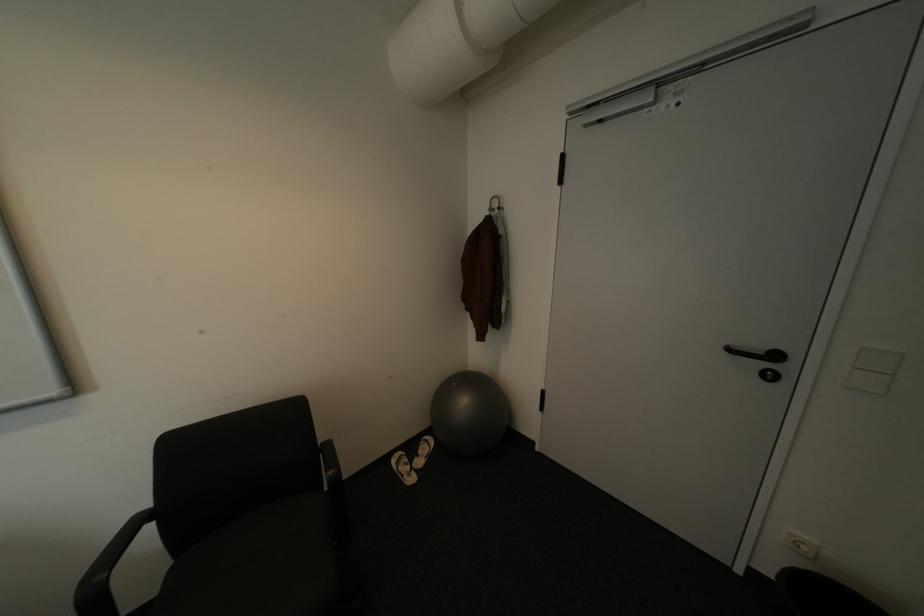
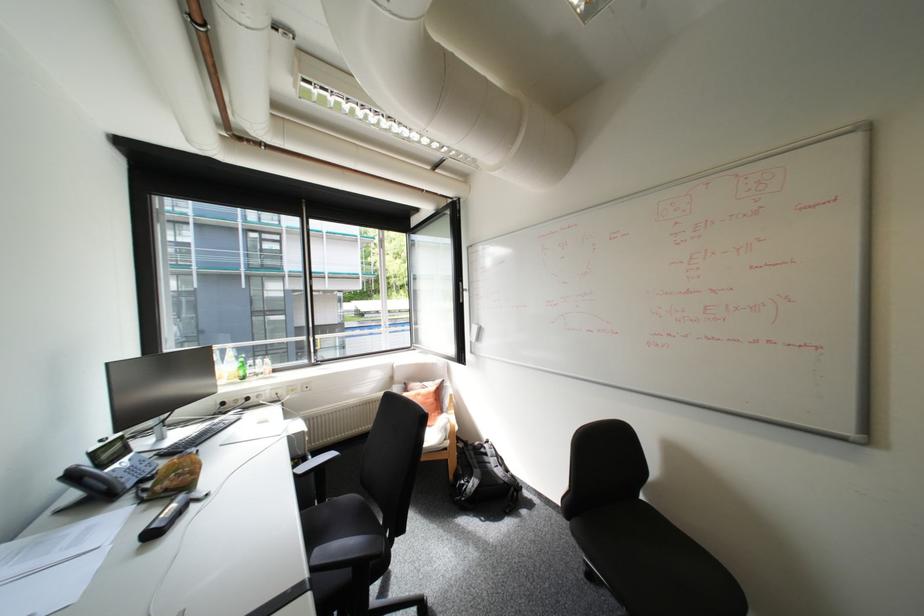
Question: The camera is either moving clockwise (left) or counter-clockwise (right) around the object. The first image is from the beginning of the video and the second image is from the end. Is the camera moving left or right when shooting the video?

Choices:
 (A) Left
 (B) Right

Answer: (B)